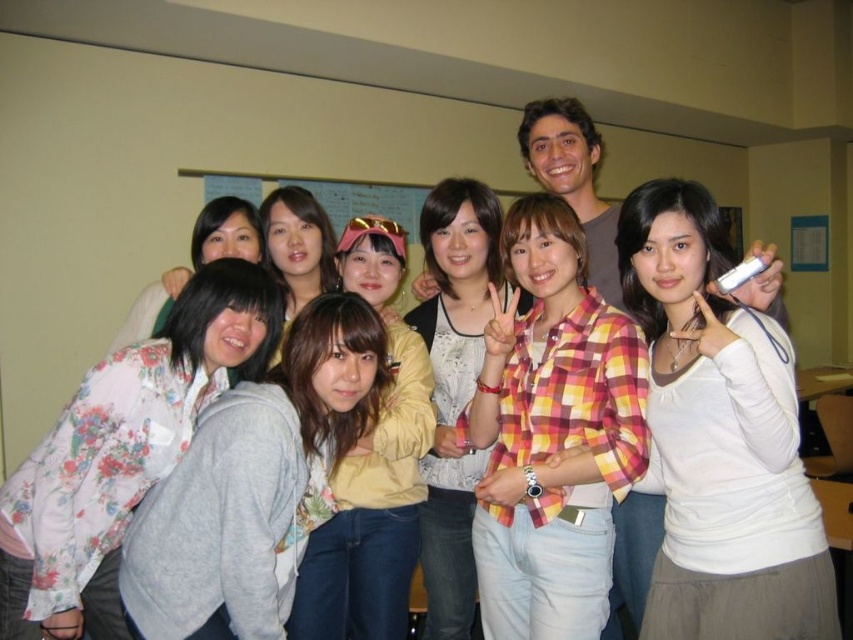
From the picture: Who is more distant from viewer, (x=367, y=250) or (x=473, y=497)?

Point (x=473, y=497)

Is point (401, 564) positioned after point (421, 568)?

No, it is not.

Is point (401, 545) closer to camera compared to point (430, 561)?

Yes, it is in front of point (430, 561).

Find the location of a particular element. Image resolution: width=853 pixels, height=640 pixels. yellow fabric at center is located at coordinates (372, 470).

Does gray fleece jacket at center appear over yellow fabric shirt at center?

No.

Can you confirm if gray fleece jacket at center is smaller than yellow fabric shirt at center?

No, gray fleece jacket at center is not smaller than yellow fabric shirt at center.

Does point (312, 362) come in front of point (294, 218)?

Yes, it is.

You are a GUI agent. You are given a task and a screenshot of the screen. Output one action in this format:
    pyautogui.click(x=<x>, y=<y>)
    Task: Click on the gray fleece jacket at center
    Image resolution: width=853 pixels, height=640 pixels.
    Given the screenshot: What is the action you would take?
    pyautogui.click(x=254, y=484)

Is gray fleece jacket at center positioned at the back of floral fabric blouse at left?

No, gray fleece jacket at center is in front of floral fabric blouse at left.

What are the coordinates of `gray fleece jacket at center` in the screenshot? It's located at (254, 484).